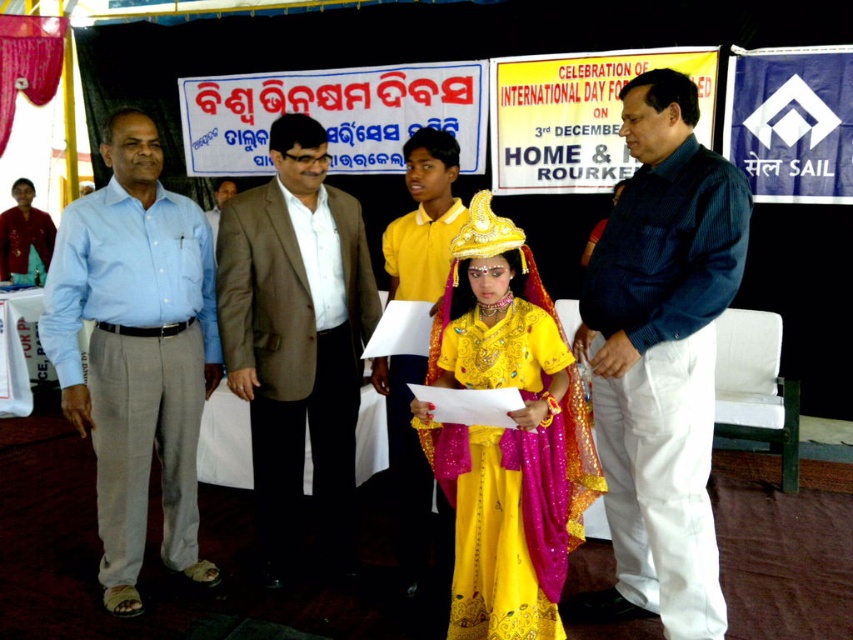
You are a photographer at the event and need to ensure both the blue striped shirt at center and the light brown suit at center are visible in your photo. Given their sizes, which one should you focus on to ensure both are captured clearly?

The blue striped shirt at center is larger in size than the light brown suit at center, so focusing on the blue striped shirt at center would help ensure both are visible as it occupies more space in the frame.

You are a photographer at the event and need to position yourself so that both the shiny yellow fabric dress at center and the brown textured suit at center are visible in your frame. Which side of the stage should you stand to ensure both are in view?

You should stand to the left side of the stage so that both the shiny yellow fabric dress at center and the brown textured suit at center are visible, as the shiny yellow fabric dress at center is positioned to the right of the brown textured suit at center.